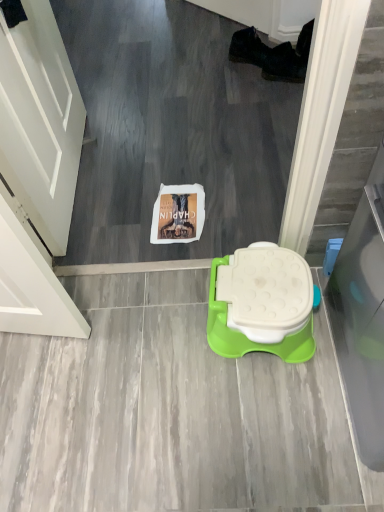
Locate an element on the screen. blank area to the left of white plastic toilet at center is located at coordinates (165, 314).